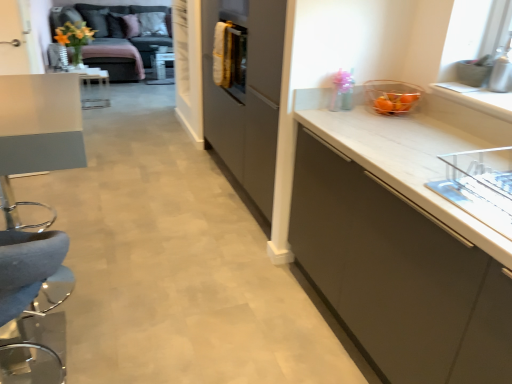
Identify the location of matte gray table at left. This screenshot has width=512, height=384. (38, 132).

Measure the distance between point (65, 44) and camera.

Point (65, 44) and camera are 4.88 meters apart.

Where is `matte yellow flower at upper left`? The image size is (512, 384). matte yellow flower at upper left is located at coordinates (74, 34).

What is the approximate width of velvet grey couch at upper left?

velvet grey couch at upper left is 6.82 feet wide.

At what (x,y) coordinates should I click in order to perform the action: click on matte gray table at left. Please return your answer as a coordinate pair (x, y). The image size is (512, 384). Looking at the image, I should click on (38, 132).

From the picture: Is velvet grey couch at upper left to the left or to the right of matte gray table at left in the image?

From the image, it's evident that velvet grey couch at upper left is to the left of matte gray table at left.

Is velvet grey couch at upper left situated inside matte gray table at left or outside?

velvet grey couch at upper left exists outside the volume of matte gray table at left.

Could you tell me if velvet grey couch at upper left is turned towards matte gray table at left?

Yes, velvet grey couch at upper left faces towards matte gray table at left.

From the image's perspective, would you say velvet grey couch at upper left is positioned over matte gray table at left?

Correct, velvet grey couch at upper left appears higher than matte gray table at left in the image.

Which is in front, point (417, 251) or point (144, 77)?

The point (417, 251) is closer.

From a real-world perspective, is white matte cabinet at right below velvet grey couch at upper left?

Actually, white matte cabinet at right is physically above velvet grey couch at upper left in the real world.

Identify the location of cabinetry on the right of velvet grey couch at upper left. The image size is (512, 384). (401, 241).

Is matte gray table at left bigger than matte yellow flower at upper left?

A: Yes, matte gray table at left is bigger than matte yellow flower at upper left.

From a real-world perspective, which object rests below the other?

matte gray table at left is physically lower.

Does point (30, 155) lie in front of point (66, 23)?

Yes, it is in front of point (66, 23).

From the image's perspective, is matte gray table at left located above matte yellow flower at upper left?

Actually, matte gray table at left appears below matte yellow flower at upper left in the image.

From the image's perspective, which is above, white matte cabinet at right or matte yellow flower at upper left?

matte yellow flower at upper left.

Image resolution: width=512 pixels, height=384 pixels. I want to click on flower that is behind the white matte cabinet at right, so click(x=74, y=34).

Looking at this image, does white matte cabinet at right turn towards matte yellow flower at upper left?

No.

Does velvet grey couch at upper left have a lesser width compared to translucent glass bowl at upper right?

No.

Which is behind, point (93, 16) or point (391, 81)?

The point (93, 16) is farther.

Is velvet grey couch at upper left turned away from translucent glass bowl at upper right?

That's not correct — velvet grey couch at upper left is not looking away from translucent glass bowl at upper right.

Is matte yellow flower at upper left aimed at white matte cabinet at right?

No, matte yellow flower at upper left does not turn towards white matte cabinet at right.

Consider the image. Can you confirm if matte yellow flower at upper left is positioned to the left of white matte cabinet at right?

Correct, you'll find matte yellow flower at upper left to the left of white matte cabinet at right.

This screenshot has width=512, height=384. In the image, there is a matte yellow flower at upper left. In order to click on cabinetry below it (from the image's perspective) in this screenshot , I will do `click(401, 241)`.

How much distance is there between matte yellow flower at upper left and white matte cabinet at right?

They are 4.40 meters apart.

Based on their sizes in the image, would you say matte gray table at left is bigger or smaller than white matte cabinet at right?

Considering their sizes, matte gray table at left takes up less space than white matte cabinet at right.

From the image's perspective, is matte gray table at left on top of white matte cabinet at right?

Correct, matte gray table at left appears higher than white matte cabinet at right in the image.

Would you say matte gray table at left is outside white matte cabinet at right?

matte gray table at left is positioned outside white matte cabinet at right.

Find the location of a particular element. The image size is (512, 384). studio couch on the left of matte gray table at left is located at coordinates point(113,39).

Locate an element on the screen. The image size is (512, 384). cabinetry on the right of velvet grey couch at upper left is located at coordinates (401, 241).

Based on their spatial positions, is matte gray table at left or translucent glass bowl at upper right closer to matte yellow flower at upper left?

matte gray table at left.

Estimate the real-world distances between objects in this image. Which object is closer to velvet grey couch at upper left, white matte cabinet at right or matte gray table at left?

The object closer to velvet grey couch at upper left is matte gray table at left.

When comparing their distances from white matte cabinet at right, does matte gray table at left or matte yellow flower at upper left seem further?

matte yellow flower at upper left is positioned further to the anchor white matte cabinet at right.

When comparing their distances from white matte cabinet at right, does velvet grey couch at upper left or matte yellow flower at upper left seem further?

velvet grey couch at upper left is positioned further to the anchor white matte cabinet at right.

Consider the image. Estimate the real-world distances between objects in this image. Which object is further from matte gray table at left, velvet grey couch at upper left or translucent glass bowl at upper right?

velvet grey couch at upper left.

When comparing their distances from translucent glass bowl at upper right, does matte yellow flower at upper left or matte gray table at left seem further?

matte yellow flower at upper left.

When comparing their distances from translucent glass bowl at upper right, does matte gray table at left or velvet grey couch at upper left seem further?

The object further to translucent glass bowl at upper right is velvet grey couch at upper left.

Based on the photo, based on their spatial positions, is velvet grey couch at upper left or white matte cabinet at right closer to matte gray table at left?

white matte cabinet at right is closer to matte gray table at left.

I want to click on table between white matte cabinet at right and velvet grey couch at upper left along the z-axis, so click(x=38, y=132).

Locate an element on the screen. The image size is (512, 384). table located between white matte cabinet at right and matte yellow flower at upper left in the depth direction is located at coordinates (38, 132).

Identify the location of appliance between matte gray table at left and matte yellow flower at upper left in the front-back direction. (392, 96).

You are a GUI agent. You are given a task and a screenshot of the screen. Output one action in this format:
    pyautogui.click(x=<x>, y=<y>)
    Task: Click on the studio couch between matte gray table at left and matte yellow flower at upper left along the z-axis
    Image resolution: width=512 pixels, height=384 pixels.
    Given the screenshot: What is the action you would take?
    pyautogui.click(x=113, y=39)